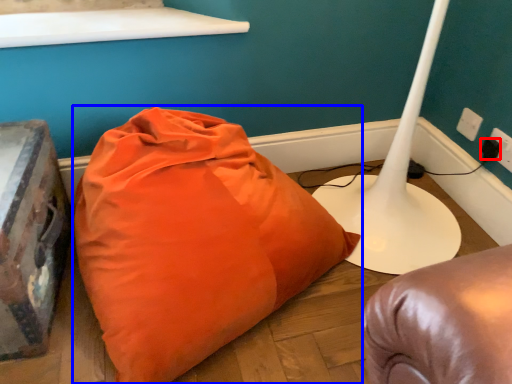
Question: Which of the following is the closest to the observer, plug (highlighted by a red box) or pillow (highlighted by a blue box)?

Choices:
 (A) plug
 (B) pillow

Answer: (B)